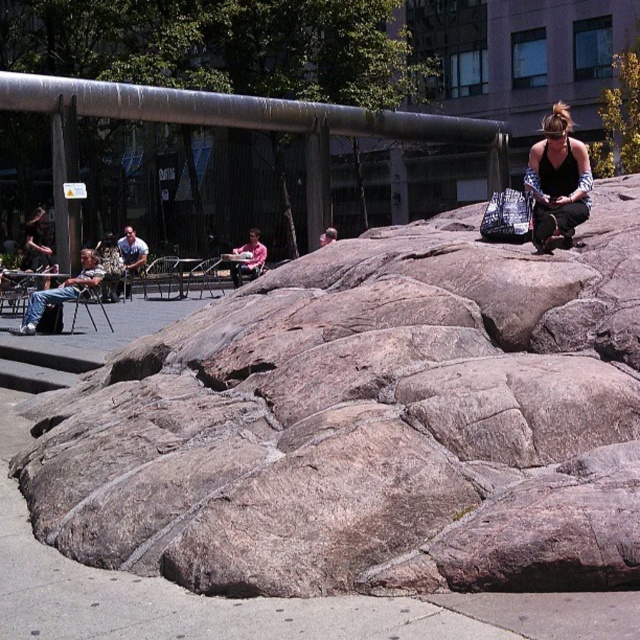
You are a delivery drone with a wingspan of 1.5 meters. You need to fly between the gray rough rock at center and the metallic cylindrical structure in the background. Can you safely pass through the gap between them without touching either object?

The gap between the gray rough rock at center and the metallic cylindrical structure in the background is 4.47 meters. Since your wingspan is 1.5 meters, which is significantly smaller than the gap, you can safely pass through without touching either object.

You are a parent with a pink fabric stroller at center and need to pass through a narrow path between two gray rough rock at center. Can the stroller fit through the path if the path is as wide as the stroller?

The gray rough rock at center is wider than the pink fabric stroller at center. Therefore, the path between the rocks may be wider than the stroller, so it should fit through.

You are a maintenance worker needing to move the matte gray chair at left closer to the gray rough rock at center. The path between them is clear. If you move the chair 5 meters towards the rock, how far apart will they be?

After moving the matte gray chair at left 5 meters closer to the gray rough rock at center, the remaining distance between them will be 2.64 meters.